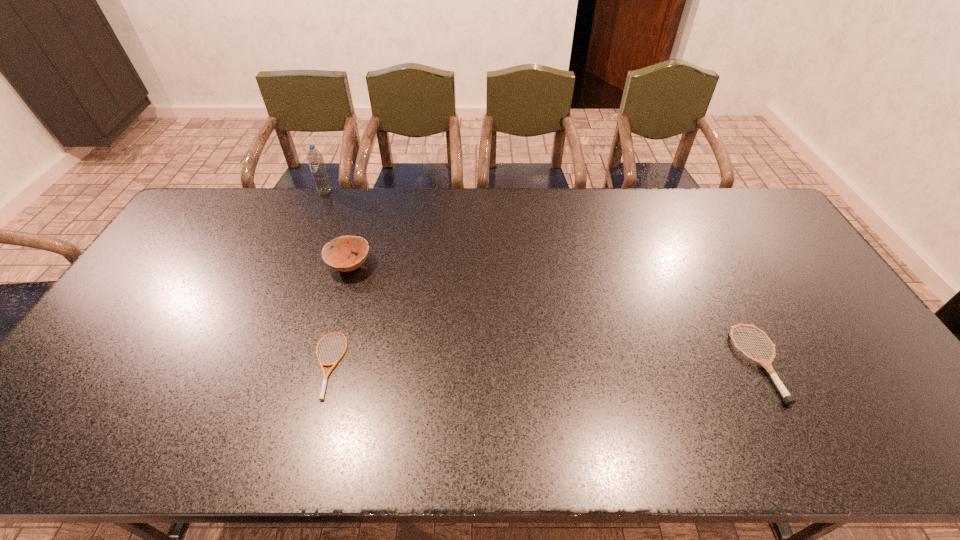
Find the location of a particular element. This screenshot has height=540, width=960. water bottle is located at coordinates (315, 159).

Find the location of a particular element. Image resolution: width=960 pixels, height=540 pixels. the leftmost object is located at coordinates tap(315, 159).

Find the location of a particular element. This screenshot has width=960, height=540. the third nearest object is located at coordinates (337, 258).

Find the location of a particular element. Image resolution: width=960 pixels, height=540 pixels. bowl is located at coordinates coord(337,258).

At what (x,y) coordinates should I click in order to perform the action: click on the rightmost object. Please return your answer as a coordinate pair (x, y). Looking at the image, I should click on (788, 399).

In order to click on the taller tennis racket in this screenshot , I will do `click(788, 399)`.

You are a GUI agent. You are given a task and a screenshot of the screen. Output one action in this format:
    pyautogui.click(x=<x>, y=<y>)
    Task: Click on the shorter tennis racket
    
    Given the screenshot: What is the action you would take?
    pyautogui.click(x=333, y=365)

Find the location of `the left tennis racket`. the left tennis racket is located at coordinates (333, 365).

Find the location of a particular element. The height and width of the screenshot is (540, 960). free space located on the front of the tallest object is located at coordinates (312, 223).

Locate an element on the screen. vacant region located 0.190m on the back of the third shortest object is located at coordinates (365, 213).